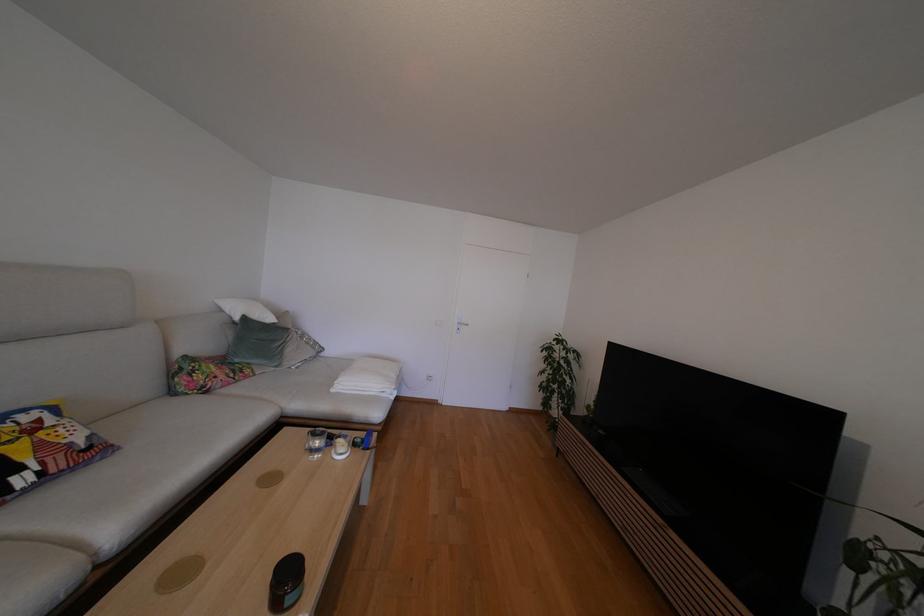
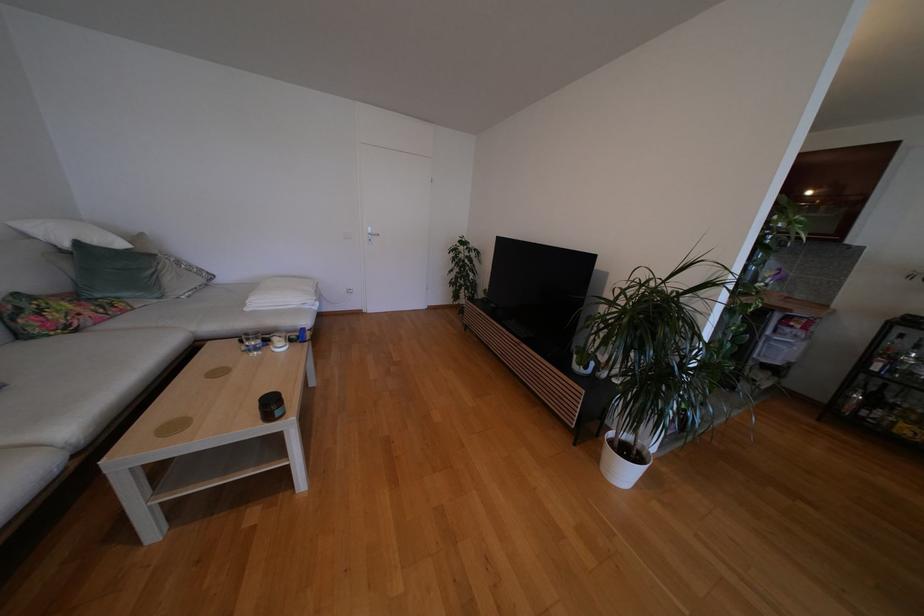
First-person continuous shooting, in which direction is the camera rotating?

The camera rotated toward right-down.